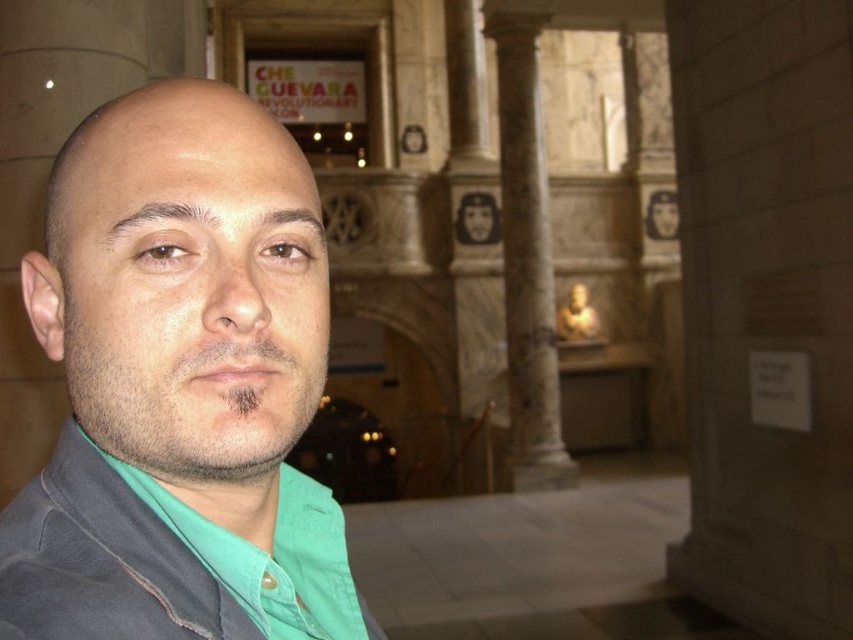
Between gray matte jacket at left and marble column at center, which one appears on the left side from the viewer's perspective?

gray matte jacket at left is more to the left.

Does gray matte jacket at left come in front of marble column at center?

Yes, gray matte jacket at left is in front of marble column at center.

Who is more forward, (167, 595) or (521, 106)?

Positioned in front is point (167, 595).

At what (x,y) coordinates should I click in order to perform the action: click on gray matte jacket at left. Please return your answer as a coordinate pair (x, y). The image size is (853, 640). Looking at the image, I should click on (180, 385).

Does gray matte jacket at left appear on the right side of dark gray matte jacket at center?

Correct, you'll find gray matte jacket at left to the right of dark gray matte jacket at center.

Can you confirm if gray matte jacket at left is bigger than dark gray matte jacket at center?

Yes.

Is point (215, 122) behind point (149, 522)?

Yes, point (215, 122) is behind point (149, 522).

You are a GUI agent. You are given a task and a screenshot of the screen. Output one action in this format:
    pyautogui.click(x=<x>, y=<y>)
    Task: Click on the gray matte jacket at left
    This screenshot has height=640, width=853.
    Given the screenshot: What is the action you would take?
    pyautogui.click(x=180, y=385)

Can you confirm if marble column at center is positioned to the left of dark gray matte jacket at center?

In fact, marble column at center is to the right of dark gray matte jacket at center.

Who is positioned more to the right, marble column at center or dark gray matte jacket at center?

marble column at center

Is point (502, 61) behind point (93, 522)?

Yes, point (502, 61) is behind point (93, 522).

Locate an element on the screen. marble column at center is located at coordinates (527, 259).